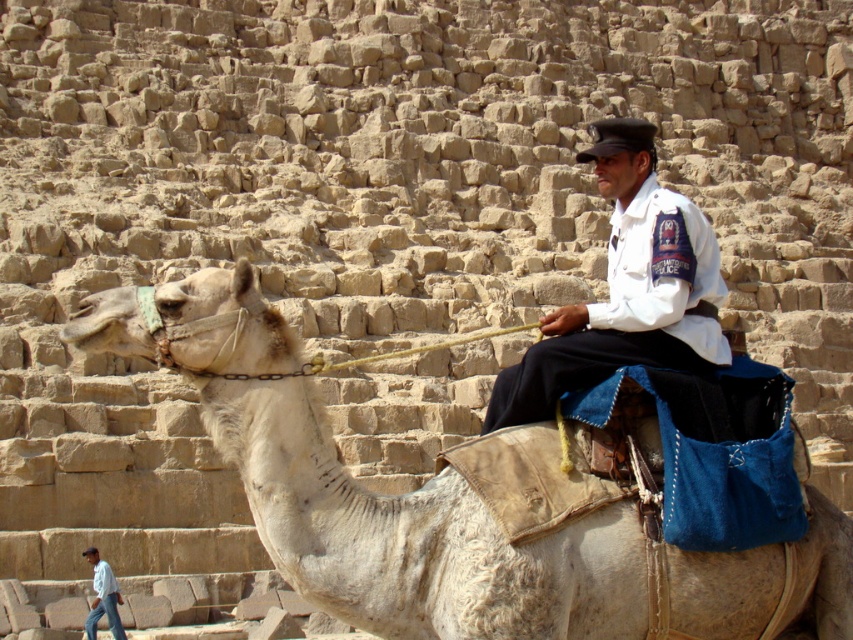
Question: Does white uniform at center have a lesser width compared to light blue shirt at lower left?

Choices:
 (A) yes
 (B) no

Answer: (B)

Question: Where is white textured camel at center located in relation to light blue shirt at lower left in the image?

Choices:
 (A) left
 (B) right

Answer: (B)

Question: Which point appears farthest from the camera in this image?

Choices:
 (A) (291, 525)
 (B) (550, 340)

Answer: (B)

Question: Which of the following is the closest to the observer?

Choices:
 (A) (108, 301)
 (B) (599, 186)

Answer: (A)

Question: Which of these objects is positioned closest to the white textured camel at center?

Choices:
 (A) light blue shirt at lower left
 (B) white uniform at center

Answer: (B)

Question: Does white textured camel at center come behind light blue shirt at lower left?

Choices:
 (A) yes
 (B) no

Answer: (B)